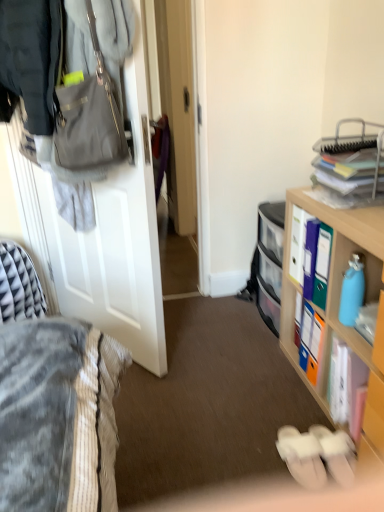
The image size is (384, 512). What do you see at coordinates (337, 453) in the screenshot?
I see `white fabric slippers at lower center, positioned as the second footwear in left-to-right order` at bounding box center [337, 453].

Find the location of `matte gray handbag at upper left`. matte gray handbag at upper left is located at coordinates (89, 118).

The width and height of the screenshot is (384, 512). What do you see at coordinates (302, 457) in the screenshot? I see `white fabric slippers at lower center, the first footwear from the left` at bounding box center [302, 457].

The height and width of the screenshot is (512, 384). I want to click on white matte door at left, so click(102, 230).

Consider the image. Which object is thinner, white matte door at left or wooden cabinet at right?

white matte door at left is thinner.

Is white matte door at left far from wooden cabinet at right?

Actually, white matte door at left and wooden cabinet at right are a little close together.

The height and width of the screenshot is (512, 384). In order to click on cabinetry beneath the white matte door at left (from a real-world perspective) in this screenshot , I will do [339, 300].

Does point (62, 300) come in front of point (363, 245)?

No, (62, 300) is further to viewer.

Considering the points (343, 443) and (138, 163), which point is in front, point (343, 443) or point (138, 163)?

The point (343, 443) is closer.

Is white fabric slippers at lower center, positioned as the second footwear in left-to-right order, positioned in front of white matte door at left?

No, it is not.

Considering the sizes of objects white fabric slippers at lower center, the first footwear positioned from the right, and white matte door at left in the image provided, who is thinner, white fabric slippers at lower center, the first footwear positioned from the right, or white matte door at left?

With smaller width is white matte door at left.

Is white fabric slippers at lower center, the first footwear positioned from the right, situated inside white matte door at left or outside?

white fabric slippers at lower center, the first footwear positioned from the right, cannot be found inside white matte door at left.

Can you see white fabric slippers at lower center, the first footwear from the left, touching matte gray handbag at upper left?

No, white fabric slippers at lower center, the first footwear from the left, is not making contact with matte gray handbag at upper left.

Looking at this image, what's the angular difference between white fabric slippers at lower center, the first footwear from the left, and matte gray handbag at upper left's facing directions?

They differ by 141 degrees in their facing directions.

Does white fabric slippers at lower center, the 2th footwear viewed from the right, have a greater height compared to matte gray handbag at upper left?

No, white fabric slippers at lower center, the 2th footwear viewed from the right, is not taller than matte gray handbag at upper left.

Considering the relative sizes of white fabric slippers at lower center, the first footwear from the left, and matte gray handbag at upper left in the image provided, is white fabric slippers at lower center, the first footwear from the left, smaller than matte gray handbag at upper left?

Yes.

Consider the image. Between wooden cabinet at right and white paper book at lower right, which one has less height?

Standing shorter between the two is white paper book at lower right.

At what (x,y) coordinates should I click in order to perform the action: click on cabinetry that appears on the right of white paper book at lower right. Please return your answer as a coordinate pair (x, y). Looking at the image, I should click on (339, 300).

Which of these two, wooden cabinet at right or white paper book at lower right, is wider?

wooden cabinet at right is wider.

Would you say wooden cabinet at right is inside or outside white paper book at lower right?

wooden cabinet at right is not inside white paper book at lower right, it's outside.

What's the angular difference between white paper book at lower right and matte gray handbag at upper left's facing directions?

49.1 degrees separate the facing orientations of white paper book at lower right and matte gray handbag at upper left.

Is the position of white paper book at lower right less distant than that of matte gray handbag at upper left?

No.

Considering the sizes of white paper book at lower right and matte gray handbag at upper left in the image, is white paper book at lower right taller or shorter than matte gray handbag at upper left?

Considering their sizes, white paper book at lower right has less height than matte gray handbag at upper left.

Could you tell me if white paper book at lower right is turned towards matte gray handbag at upper left?

No, white paper book at lower right is not oriented towards matte gray handbag at upper left.

In terms of width, does matte gray handbag at upper left look wider or thinner when compared to white matte door at left?

matte gray handbag at upper left is wider than white matte door at left.

Based on the photo, who is more distant, matte gray handbag at upper left or white matte door at left?

white matte door at left.

Is matte gray handbag at upper left located outside white matte door at left?

Yes, matte gray handbag at upper left is outside of white matte door at left.

Which object is wider, white matte door at left or white paper book at lower right?

white paper book at lower right is wider.

Is white matte door at left outside of white paper book at lower right?

Yes, white matte door at left is outside of white paper book at lower right.

Considering the relative positions of white matte door at left and white paper book at lower right in the image provided, is white matte door at left to the left of white paper book at lower right from the viewer's perspective?

Yes.

Find the location of a particular element. The image size is (384, 512). cabinetry that appears below the white matte door at left (from the image's perspective) is located at coordinates (339, 300).

Where is `the 2nd footwear counting from the right side of the white matte door at left`? The height and width of the screenshot is (512, 384). the 2nd footwear counting from the right side of the white matte door at left is located at coordinates (337, 453).

Based on their spatial positions, is white paper book at lower right or white fabric slippers at lower center, the 2th footwear viewed from the right, closer to white fabric slippers at lower center, the first footwear positioned from the right?

white fabric slippers at lower center, the 2th footwear viewed from the right, is closer to white fabric slippers at lower center, the first footwear positioned from the right.

Looking at this image, looking at the image, which one is located further to clear plastic drawers at center, white matte door at left or white fabric slippers at lower center, the first footwear from the left?

white fabric slippers at lower center, the first footwear from the left, is positioned further to the anchor clear plastic drawers at center.

Based on their spatial positions, is white matte door at left or matte gray handbag at upper left further from white fabric slippers at lower center, the first footwear positioned from the right?

Among the two, matte gray handbag at upper left is located further to white fabric slippers at lower center, the first footwear positioned from the right.

Estimate the real-world distances between objects in this image. Which object is further from clear plastic drawers at center, white fabric slippers at lower center, positioned as the second footwear in left-to-right order, or white fabric slippers at lower center, the 2th footwear viewed from the right?

The object further to clear plastic drawers at center is white fabric slippers at lower center, positioned as the second footwear in left-to-right order.

Looking at the image, which one is located further to white fabric slippers at lower center, the first footwear from the left, matte gray handbag at upper left or wooden cabinet at right?

matte gray handbag at upper left lies further to white fabric slippers at lower center, the first footwear from the left, than the other object.

When comparing their distances from matte gray handbag at upper left, does white matte door at left or white fabric slippers at lower center, the first footwear positioned from the right, seem further?

Based on the image, white fabric slippers at lower center, the first footwear positioned from the right, appears to be further to matte gray handbag at upper left.

From the image, which object appears to be farther from white paper book at lower right, clear plastic drawers at center or white fabric slippers at lower center, positioned as the second footwear in left-to-right order?

The object further to white paper book at lower right is clear plastic drawers at center.

Estimate the real-world distances between objects in this image. Which object is further from clear plastic drawers at center, matte gray handbag at upper left or white fabric slippers at lower center, the first footwear positioned from the right?

matte gray handbag at upper left.

The image size is (384, 512). I want to click on footwear between white matte door at left and clear plastic drawers at center, so click(302, 457).

Where is `book between matte gray handbag at upper left and white fabric slippers at lower center, the first footwear from the left, in the vertical direction`? The image size is (384, 512). book between matte gray handbag at upper left and white fabric slippers at lower center, the first footwear from the left, in the vertical direction is located at coordinates (345, 383).

Identify the location of book between matte gray handbag at upper left and white fabric slippers at lower center, positioned as the second footwear in left-to-right order, in the up-down direction. The height and width of the screenshot is (512, 384). (345, 383).

The height and width of the screenshot is (512, 384). What are the coordinates of `cabinet located between matte gray handbag at upper left and wooden cabinet at right in the left-right direction` in the screenshot? It's located at [x=269, y=262].